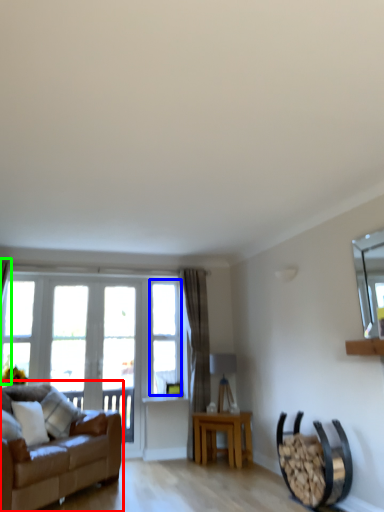
Question: Considering the real-world distances, which object is farthest from studio couch (highlighted by a red box)? window (highlighted by a blue box) or curtain (highlighted by a green box)?

Choices:
 (A) window
 (B) curtain

Answer: (B)